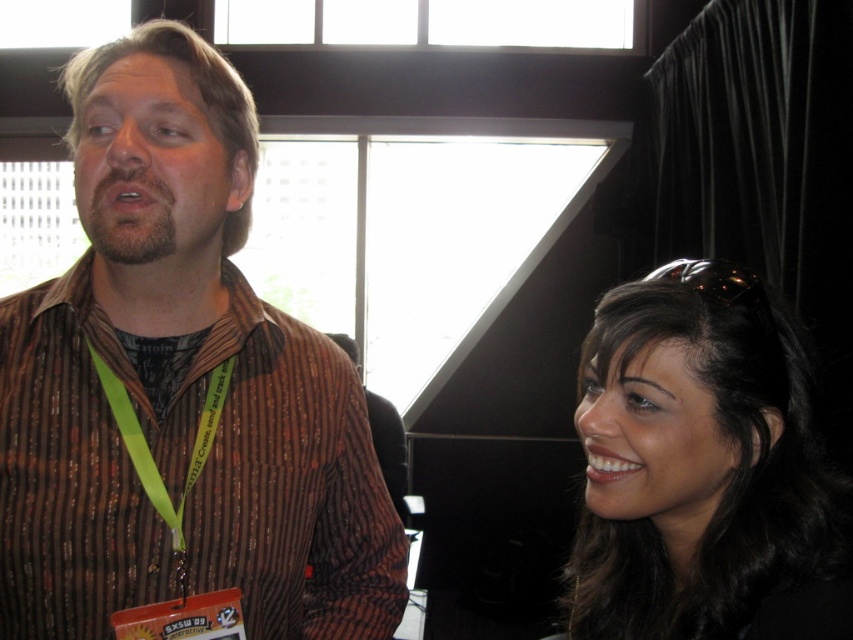
Question: Can you confirm if brown striped shirt at left is thinner than dark brown hair at upper right?

Choices:
 (A) no
 (B) yes

Answer: (A)

Question: Which point is farther from the camera taking this photo?

Choices:
 (A) (689, 573)
 (B) (222, 404)

Answer: (B)

Question: Is brown striped shirt at left smaller than dark brown hair at upper right?

Choices:
 (A) yes
 (B) no

Answer: (B)

Question: From the image, what is the correct spatial relationship of brown striped shirt at left in relation to brown striped shirt at center?

Choices:
 (A) right
 (B) left

Answer: (B)

Question: Among these points, which one is nearest to the camera?

Choices:
 (A) (386, 483)
 (B) (175, 579)

Answer: (B)

Question: Considering the real-world distances, which object is closest to the brown striped shirt at left?

Choices:
 (A) brown striped shirt at center
 (B) neon yellow fabric lanyard at left
 (C) dark brown hair at upper right

Answer: (B)